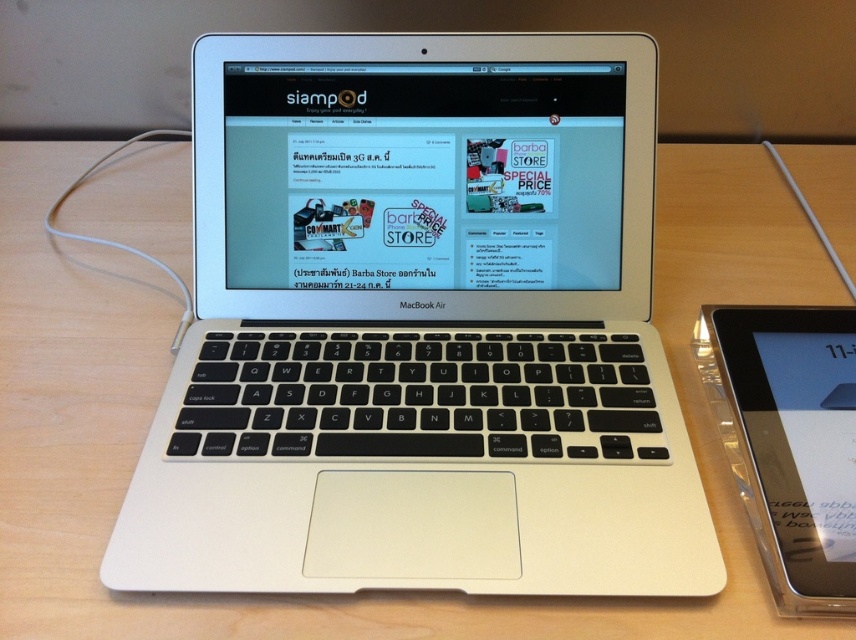
Question: Does silver metallic laptop at center have a greater width compared to clear plastic tablet at right?

Choices:
 (A) yes
 (B) no

Answer: (A)

Question: Among these objects, which one is nearest to the camera?

Choices:
 (A) silver metallic laptop at center
 (B) clear plastic tablet at right

Answer: (B)

Question: Which of the following is the farthest from the observer?

Choices:
 (A) silver metallic laptop at center
 (B) clear plastic tablet at right

Answer: (A)

Question: From the image, what is the correct spatial relationship of silver metallic laptop at center in relation to clear plastic tablet at right?

Choices:
 (A) below
 (B) above

Answer: (B)

Question: Among these points, which one is nearest to the camera?

Choices:
 (A) (453, 163)
 (B) (835, 320)

Answer: (B)

Question: Can you confirm if silver metallic laptop at center is smaller than clear plastic tablet at right?

Choices:
 (A) yes
 (B) no

Answer: (B)